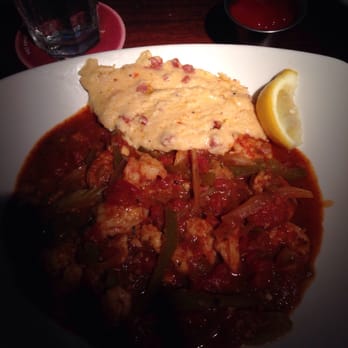
I want to click on pink coaster, so click(x=107, y=34).